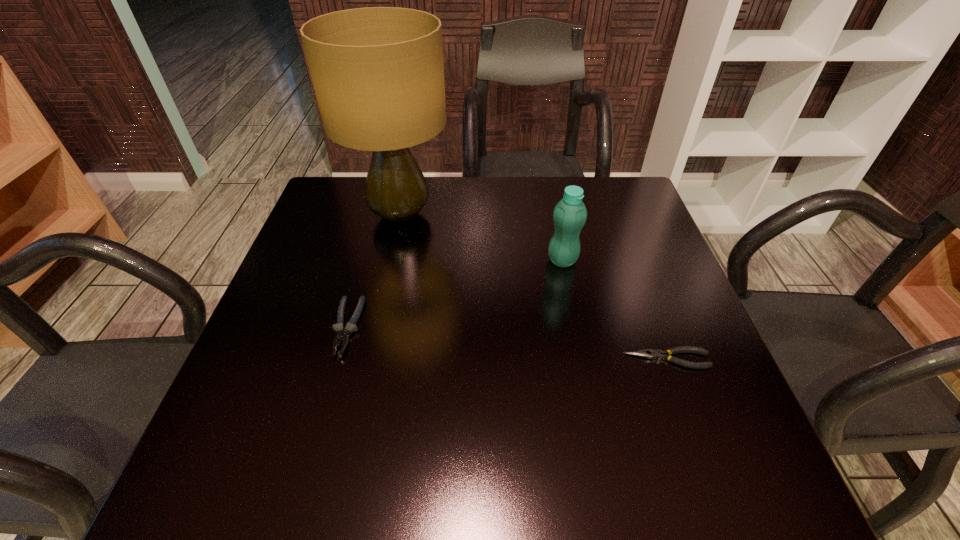
The width and height of the screenshot is (960, 540). In order to click on the tallest object in this screenshot , I will do `click(378, 73)`.

Identify the location of the farthest object. Image resolution: width=960 pixels, height=540 pixels. (378, 73).

The width and height of the screenshot is (960, 540). In order to click on the second tallest object in this screenshot , I will do `click(569, 216)`.

Locate an element on the screen. the third object from left to right is located at coordinates (569, 216).

Find the location of a particular element. the taller pliers is located at coordinates (342, 335).

Find the location of `the left pliers`. the left pliers is located at coordinates (342, 335).

This screenshot has height=540, width=960. I want to click on the shorter pliers, so click(x=644, y=353).

Where is `the shortest object`? the shortest object is located at coordinates (644, 353).

Where is `vacant space situated on the right of the tallest object`? vacant space situated on the right of the tallest object is located at coordinates (589, 215).

You are a GUI agent. You are given a task and a screenshot of the screen. Output one action in this format:
    pyautogui.click(x=<x>, y=<y>)
    Task: Click on the free space located at the front cap of the third object from left to right
    The width and height of the screenshot is (960, 540).
    Given the screenshot: What is the action you would take?
    pyautogui.click(x=580, y=347)